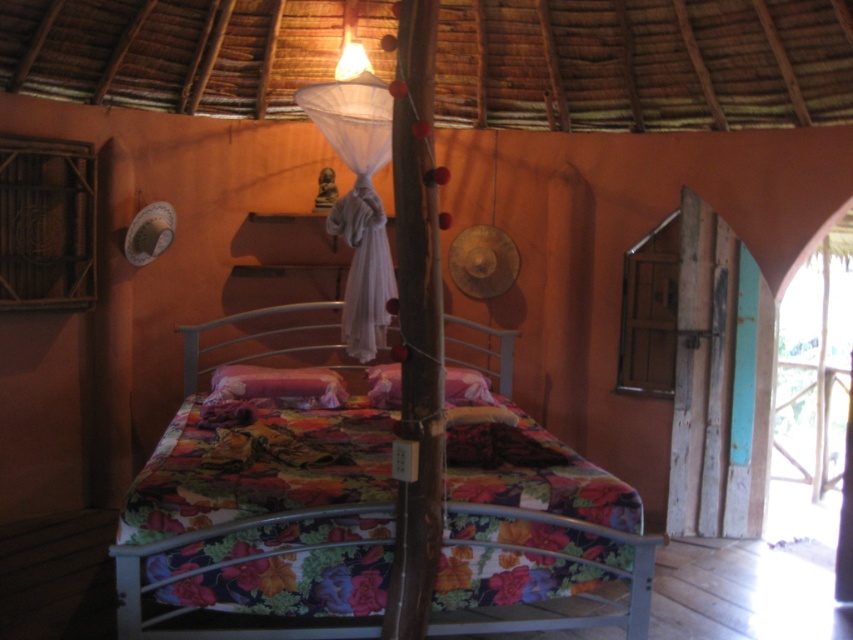
Question: Can you confirm if floral fabric bed at center is positioned below velvet pink pillow at center?

Choices:
 (A) no
 (B) yes

Answer: (B)

Question: Does floral fabric bed at center appear over velvet pink pillow at center?

Choices:
 (A) yes
 (B) no

Answer: (B)

Question: Can you confirm if floral fabric bed at center is positioned above velvet pink pillow at center?

Choices:
 (A) yes
 (B) no

Answer: (B)

Question: Which object appears farthest from the camera in this image?

Choices:
 (A) floral fabric bed at center
 (B) velvet pink pillow at center

Answer: (B)

Question: Which point is farther to the camera?

Choices:
 (A) velvet pink pillow at center
 (B) floral fabric bed at center

Answer: (A)

Question: Which object appears closest to the camera in this image?

Choices:
 (A) velvet pink pillow at center
 (B) floral fabric bed at center

Answer: (B)